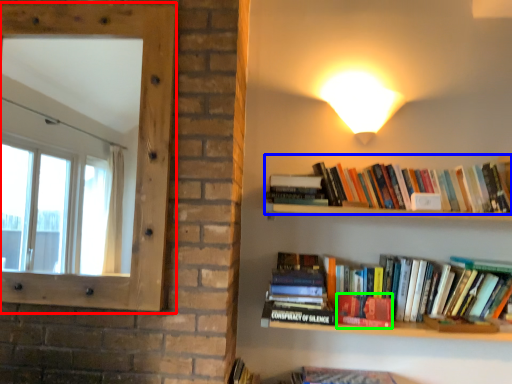
Question: Which object is the closest to the window screen (highlighted by a red box)? Choose among these: book (highlighted by a blue box) or paperback book (highlighted by a green box).

Choices:
 (A) book
 (B) paperback book

Answer: (A)